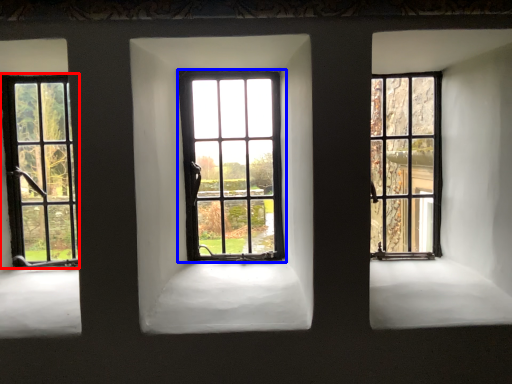
Question: Which of the following is the closest to the observer, window (highlighted by a red box) or window (highlighted by a blue box)?

Choices:
 (A) window
 (B) window

Answer: (B)